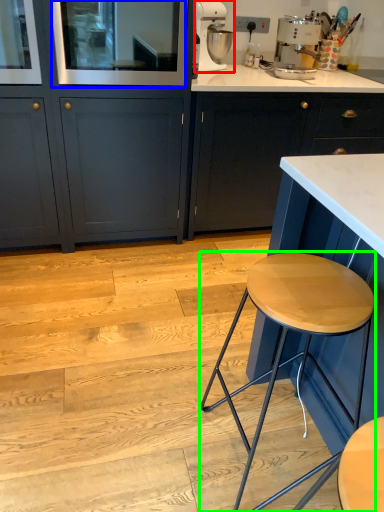
Question: Which object is positioned farthest from kitchen appliance (highlighted by a red box)? Select from glass door (highlighted by a blue box) and stool (highlighted by a green box).

Choices:
 (A) glass door
 (B) stool

Answer: (B)